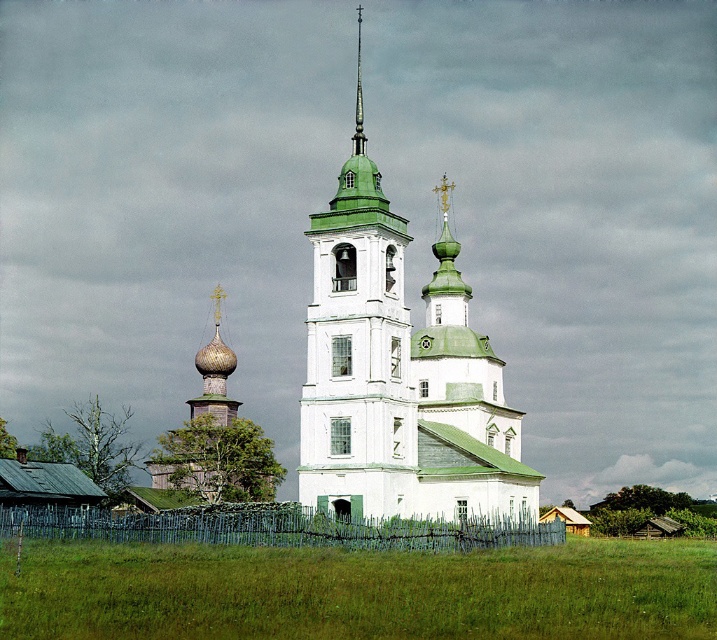
Is green wooden fence at lower center to the right of green polished dome at upper center from the viewer's perspective?

No, green wooden fence at lower center is not to the right of green polished dome at upper center.

Who is shorter, green wooden fence at lower center or green polished dome at upper center?

Standing shorter between the two is green wooden fence at lower center.

Which is in front, point (262, 538) or point (445, 211)?

Point (262, 538) is more forward.

Where is `green wooden fence at lower center`? This screenshot has width=717, height=640. green wooden fence at lower center is located at coordinates (275, 528).

This screenshot has width=717, height=640. Describe the element at coordinates (358, 592) in the screenshot. I see `green grass at lower center` at that location.

Can you confirm if green grass at lower center is smaller than white painted wood church at center?

Indeed, green grass at lower center has a smaller size compared to white painted wood church at center.

This screenshot has width=717, height=640. What do you see at coordinates (358, 592) in the screenshot?
I see `green grass at lower center` at bounding box center [358, 592].

This screenshot has height=640, width=717. In order to click on green grass at lower center in this screenshot , I will do `click(358, 592)`.

The height and width of the screenshot is (640, 717). Describe the element at coordinates (398, 372) in the screenshot. I see `white painted wood church at center` at that location.

Who is higher up, white painted wood church at center or green polished dome at upper center?

white painted wood church at center is above.

Who is more forward, (536, 474) or (442, 236)?

Point (536, 474) is in front.

This screenshot has width=717, height=640. In order to click on white painted wood church at center in this screenshot , I will do `click(398, 372)`.